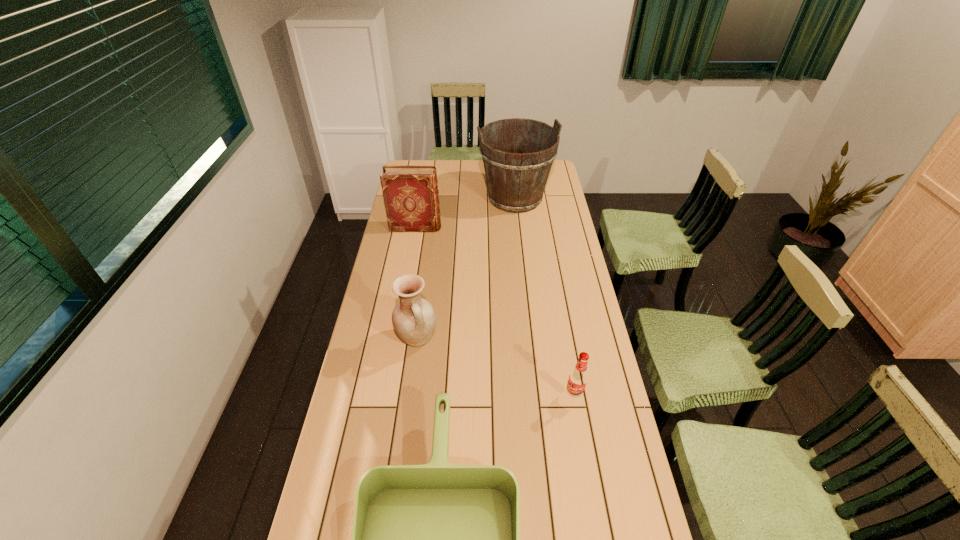
You are a GUI agent. You are given a task and a screenshot of the screen. Output one action in this format:
    pyautogui.click(x=<x>, y=<y>)
    Task: Click on the vacant space that satisfies the following two spatial constraints: 1. on the spine side of the hardback book; 2. on the right side of the pottery
    
    Given the screenshot: What is the action you would take?
    pyautogui.click(x=396, y=339)